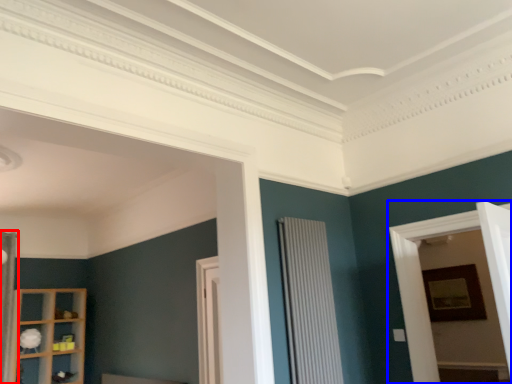
Question: Which object is further to the camera taking this photo, curtain (highlighted by a red box) or bay window (highlighted by a blue box)?

Choices:
 (A) curtain
 (B) bay window

Answer: (A)